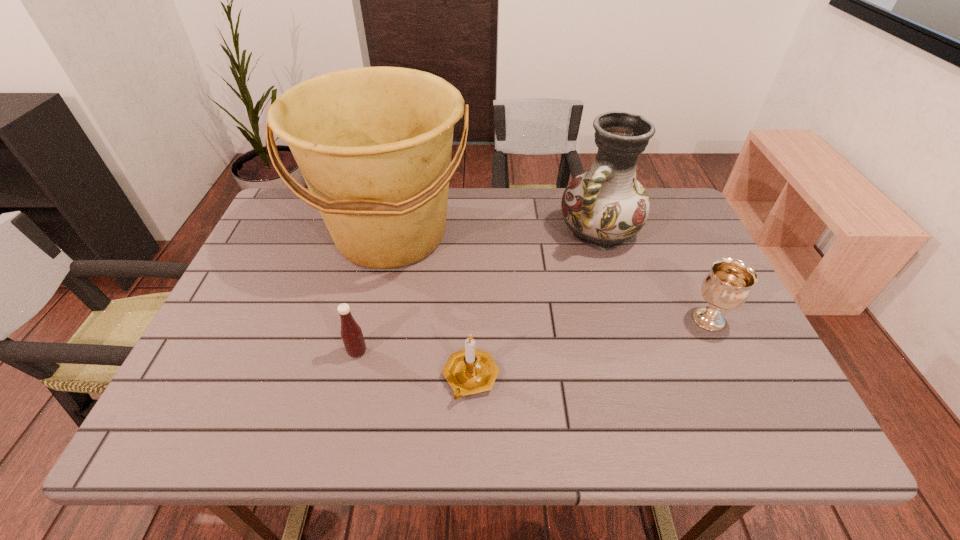
Image resolution: width=960 pixels, height=540 pixels. Identify the location of bucket. pos(374,144).

What are the coordinates of `the second object from right to left` in the screenshot? It's located at (605, 206).

The image size is (960, 540). What are the coordinates of `vase` in the screenshot? It's located at (605, 206).

This screenshot has height=540, width=960. I want to click on the rightmost object, so click(x=727, y=286).

Locate an element on the screen. The width and height of the screenshot is (960, 540). chalice is located at coordinates (727, 286).

Image resolution: width=960 pixels, height=540 pixels. Identify the location of Tabasco sauce. point(351,333).

You are a GUI agent. You are given a task and a screenshot of the screen. Output one action in this format:
    pyautogui.click(x=<x>, y=<y>)
    Task: Click on the candle holder
    The height and width of the screenshot is (540, 960).
    Given the screenshot: What is the action you would take?
    pyautogui.click(x=469, y=371)

At what (x,y) coordinates should I click in order to perform the action: click on vacant space located on the side of the bucket with the handle. Please return your answer as a coordinate pair (x, y). Looking at the image, I should click on (358, 387).

Locate an element on the screen. The height and width of the screenshot is (540, 960). vacant space located 0.290m on the left of the vase is located at coordinates (459, 233).

In order to click on vacant space located 0.290m on the back of the third farthest object in this screenshot , I will do `click(666, 231)`.